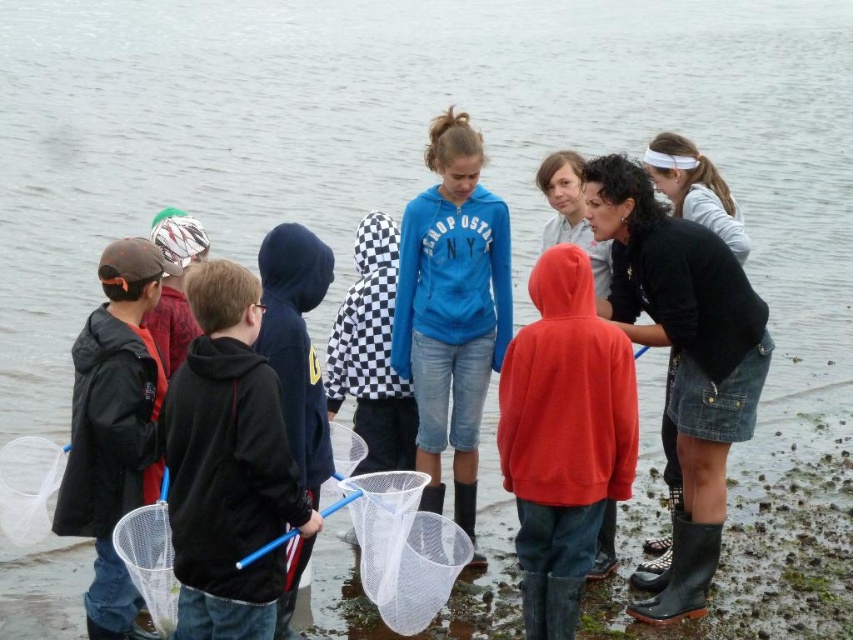
You are a photographer trying to capture a clear shot of the black fleece jacket at center without the matte black jacket at left blocking it. Based on the scene, can you position yourself to do so?

Yes, since the black fleece jacket at center is in front of the matte black jacket at left, you can position yourself behind the black fleece jacket at center to ensure the matte black jacket at left is not blocking the view.

You are a photographer trying to capture a clear shot of the black fleece jacket at center and the white mesh fishing net at lower center. Based on their sizes in the image, which object would appear larger in your photo?

The black fleece jacket at center appears larger in the photo because it has a greater height compared to the white mesh fishing net at lower center.

You are a photographer trying to capture a clear shot of the matte blue hoodie at center and the white mesh fishing net at lower center. Based on their positions, which object should you focus on first to ensure both are in frame without moving the camera?

The matte blue hoodie at center is positioned on the right side of the white mesh fishing net at lower center. To capture both in frame without moving the camera, focus on the white mesh fishing net at lower center first, as it is closer to the center of the image and the hoodie is to its right, ensuring both are within the shot.